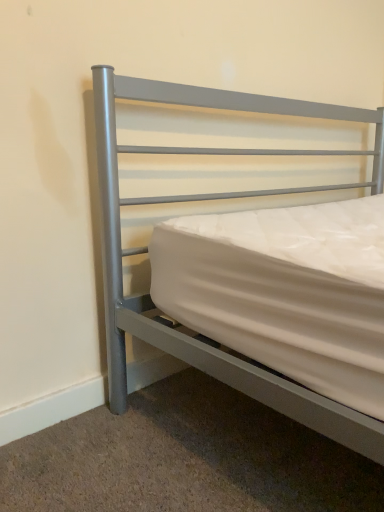
What do you see at coordinates (214, 199) in the screenshot? I see `satin silver bed at center` at bounding box center [214, 199].

This screenshot has height=512, width=384. Identify the location of satin silver bed at center. (214, 199).

Find the location of a particular element. satin silver bed at center is located at coordinates (214, 199).